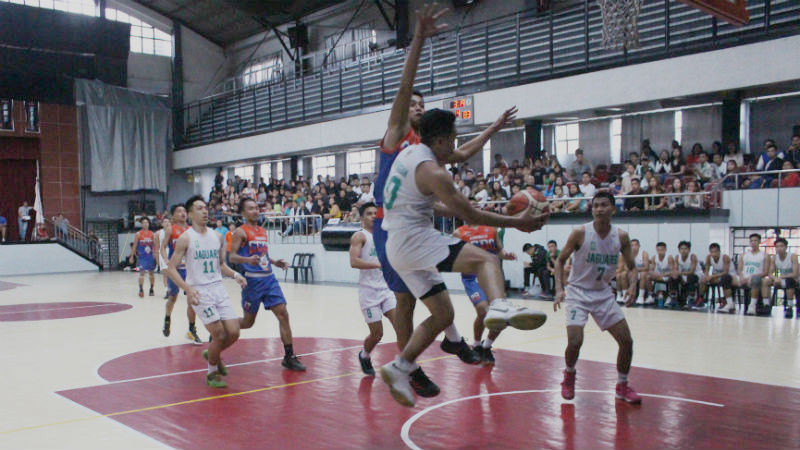
What are the coordinates of `red flooring` in the screenshot? It's located at (324, 415).